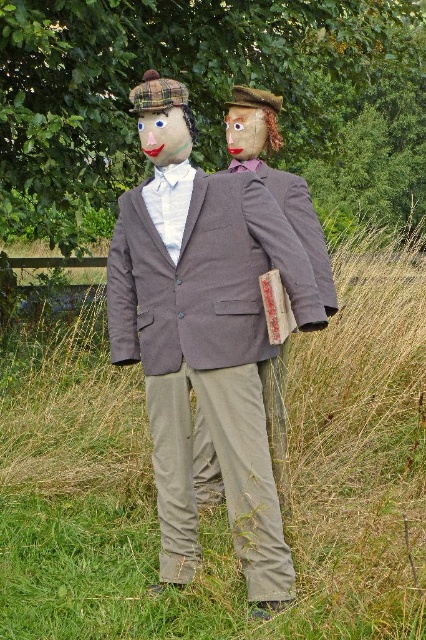
Can you confirm if green grass at center is positioned above matte gray suit at center?

Actually, green grass at center is below matte gray suit at center.

The image size is (426, 640). What do you see at coordinates (221, 508) in the screenshot?
I see `green grass at center` at bounding box center [221, 508].

Image resolution: width=426 pixels, height=640 pixels. I want to click on green grass at center, so click(x=221, y=508).

Is green grass at center bigger than matte brown mask at center?

Yes, green grass at center is bigger than matte brown mask at center.

This screenshot has height=640, width=426. I want to click on green grass at center, so click(221, 508).

Between matte gray suit at center and matte brown mask at center, which one has less height?

matte brown mask at center is shorter.

Does matte gray suit at center have a greater height compared to matte brown mask at center?

Indeed, matte gray suit at center has a greater height compared to matte brown mask at center.

Is point (325, 250) positioned before point (244, 120)?

Yes, point (325, 250) is in front of point (244, 120).

The height and width of the screenshot is (640, 426). What are the coordinates of `matte gray suit at center` in the screenshot? It's located at (296, 220).